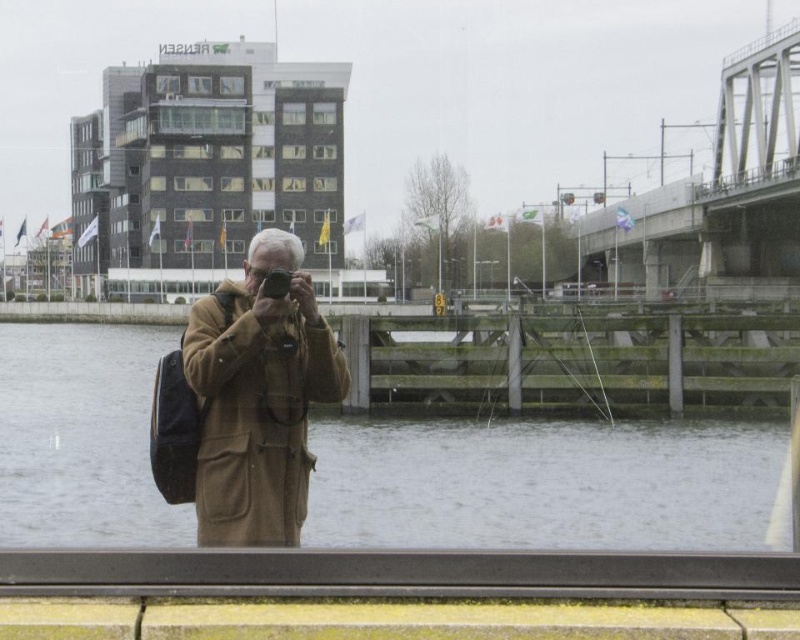
Question: From the image, what is the correct spatial relationship of brown wool coat at center in relation to matte black camera at center?

Choices:
 (A) left
 (B) right

Answer: (A)

Question: Which of the following is the farthest from the observer?

Choices:
 (A) brown wool coat at center
 (B) matte black camera at center

Answer: (B)

Question: Which object is closer to the camera taking this photo?

Choices:
 (A) brown wool coat at center
 (B) brown water at center

Answer: (A)

Question: Does brown water at center appear on the left side of brown wool coat at center?

Choices:
 (A) yes
 (B) no

Answer: (A)

Question: Does brown wool coat at center have a larger size compared to matte black camera at center?

Choices:
 (A) yes
 (B) no

Answer: (A)

Question: Which point is closer to the camera taking this photo?

Choices:
 (A) (745, 429)
 (B) (262, 284)
 (C) (212, 403)

Answer: (B)